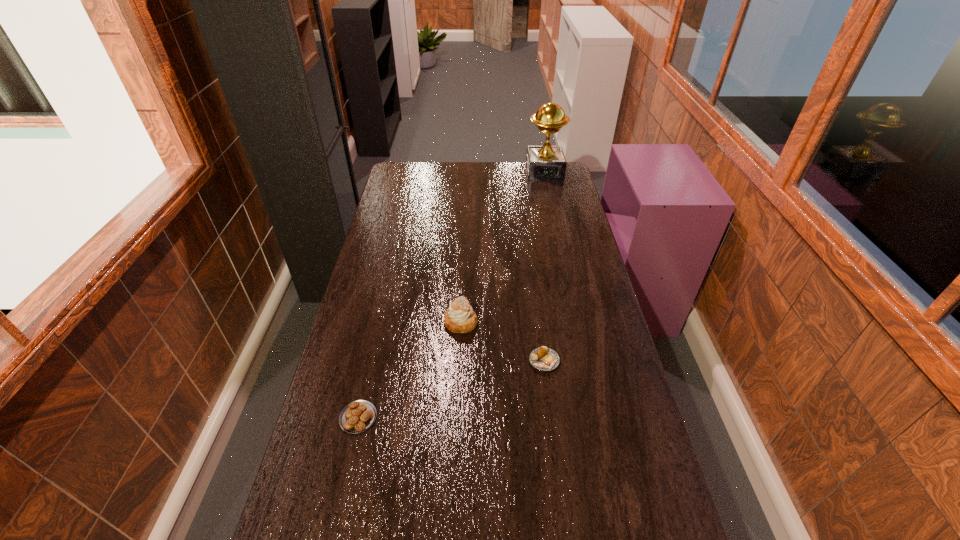
At what (x,y) coordinates should I click in order to perform the action: click on vacant space located 0.370m on the left of the second nearest pastry. Please return your answer as a coordinate pair (x, y). The width and height of the screenshot is (960, 540). Looking at the image, I should click on [408, 361].

At what (x,y) coordinates should I click in order to perform the action: click on vacant space located on the front of the leftmost pastry. Please return your answer as a coordinate pair (x, y). Looking at the image, I should click on pos(342,489).

Locate an element on the screen. object positioned at the far edge is located at coordinates (546, 162).

Identify the location of object that is at the left edge. The image size is (960, 540). (358, 416).

Image resolution: width=960 pixels, height=540 pixels. I want to click on object that is at the right edge, so click(x=546, y=162).

Identify the location of object that is at the far right corner. (546, 162).

Where is `vacant area at the far edge`? vacant area at the far edge is located at coordinates (452, 178).

In order to click on vacant area at the left edge in this screenshot , I will do `click(374, 307)`.

In the image, there is a desktop. At what (x,y) coordinates should I click in order to perform the action: click on free space at the right edge. Please return your answer as a coordinate pair (x, y). Image resolution: width=960 pixels, height=540 pixels. Looking at the image, I should click on (594, 340).

You are a GUI agent. You are given a task and a screenshot of the screen. Output one action in this format:
    pyautogui.click(x=<x>, y=<y>)
    Task: Click on the free space at the far left corner
    Image resolution: width=960 pixels, height=540 pixels.
    Given the screenshot: What is the action you would take?
    pyautogui.click(x=406, y=170)